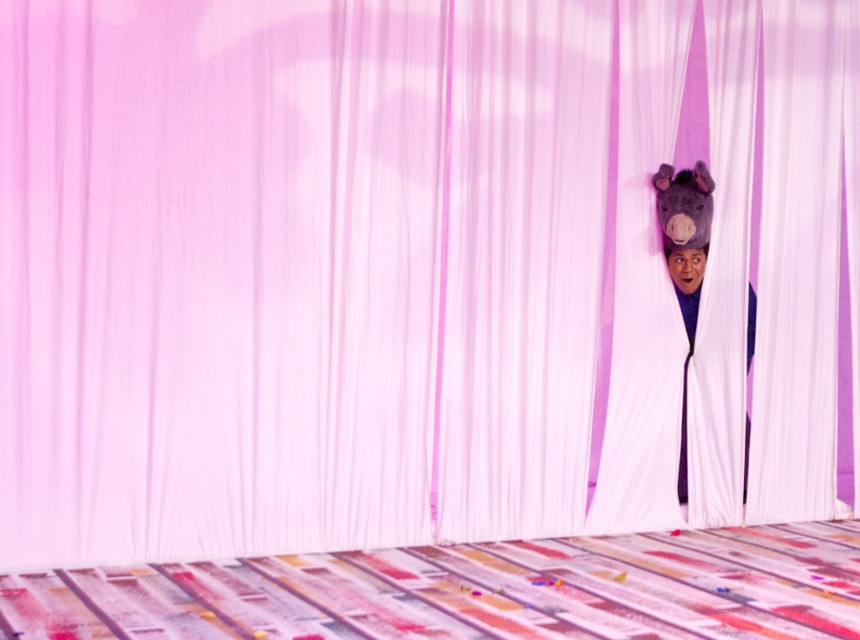
Question: Is multicolored fabric bed at center wider than purple satin mask at upper right?

Choices:
 (A) no
 (B) yes

Answer: (B)

Question: Is multicolored fabric bed at center to the left of purple satin mask at upper right from the viewer's perspective?

Choices:
 (A) no
 (B) yes

Answer: (B)

Question: Observing the image, what is the correct spatial positioning of multicolored fabric bed at center in reference to purple satin mask at upper right?

Choices:
 (A) left
 (B) right

Answer: (A)